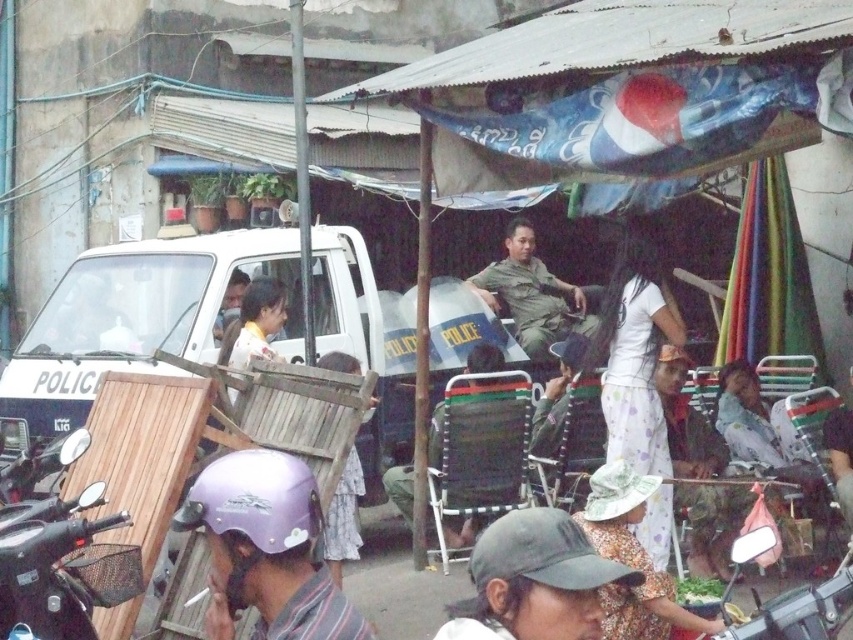
Is camouflage fabric uniform at center to the right of light brown wooden chair at center from the viewer's perspective?

Correct, you'll find camouflage fabric uniform at center to the right of light brown wooden chair at center.

Does camouflage fabric uniform at center appear over light brown wooden chair at center?

Yes.

This screenshot has width=853, height=640. In order to click on camouflage fabric uniform at center in this screenshot , I will do `click(532, 294)`.

Identify the location of camouflage fabric uniform at center. (532, 294).

Does purple matte helmet at lower left come behind wooden chair at center?

No, purple matte helmet at lower left is in front of wooden chair at center.

Is purple matte helmet at lower left to the left of wooden chair at center from the viewer's perspective?

Yes, purple matte helmet at lower left is to the left of wooden chair at center.

This screenshot has width=853, height=640. What are the coordinates of `purple matte helmet at lower left` in the screenshot? It's located at (265, 548).

Who is higher up, dark gray fabric cap at lower center or wooden chair at center?

dark gray fabric cap at lower center is higher up.

Is dark gray fabric cap at lower center smaller than wooden chair at center?

Indeed, dark gray fabric cap at lower center has a smaller size compared to wooden chair at center.

Is point (589, 616) behind point (352, 365)?

No, it is in front of (352, 365).

Identify the location of dark gray fabric cap at lower center. (534, 580).